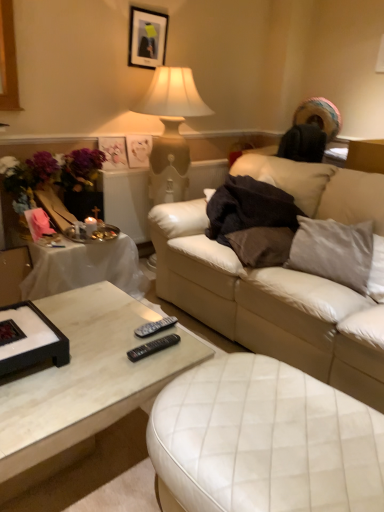
Locate an element on the screen. The height and width of the screenshot is (512, 384). free space in front of black plastic remote at lower center, which is counted as the 1th remote, starting from the front is located at coordinates (140, 375).